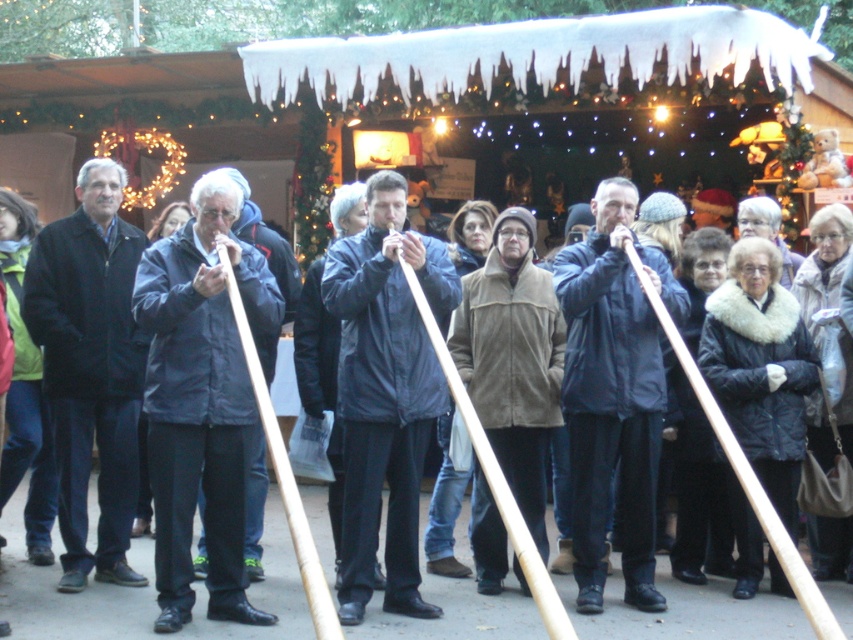
Is dark blue jacket at center to the right of brown suede jacket at center from the viewer's perspective?

No, dark blue jacket at center is not to the right of brown suede jacket at center.

Looking at this image, how far apart are dark blue jacket at center and brown suede jacket at center?

A distance of 1.51 meters exists between dark blue jacket at center and brown suede jacket at center.

Which is in front, point (231, 243) or point (537, 310)?

Point (231, 243) is more forward.

Identify the location of dark blue jacket at center. The height and width of the screenshot is (640, 853). (201, 400).